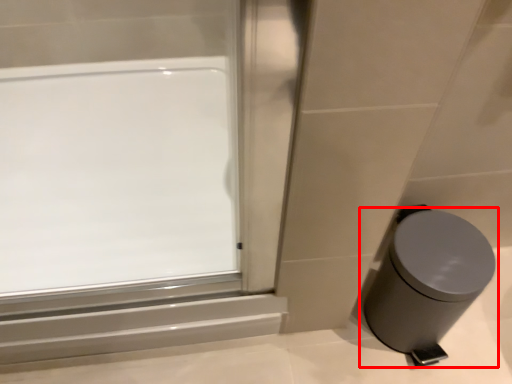
Question: In this image, where is waste container (annotated by the red box) located relative to window?

Choices:
 (A) left
 (B) right

Answer: (B)